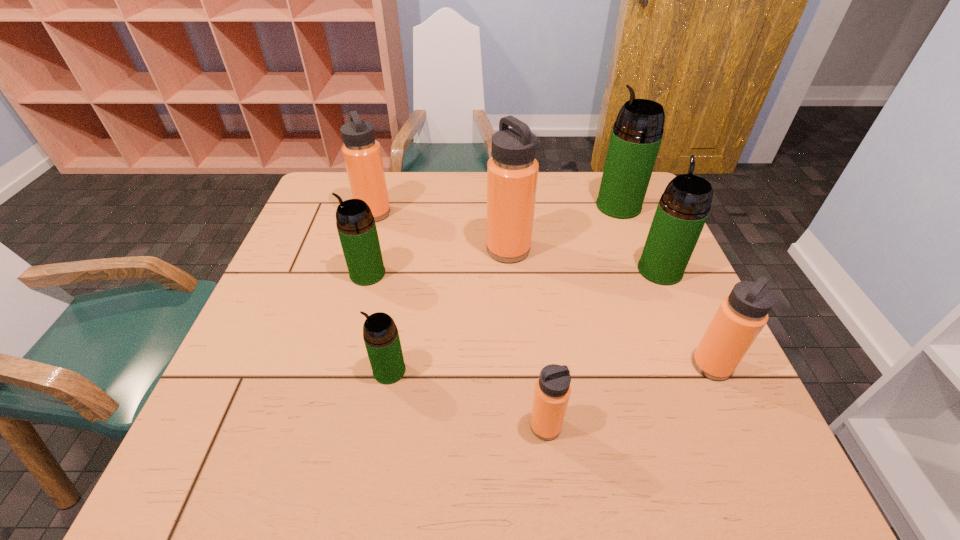
Find the location of `the nearest thermos bottle`. the nearest thermos bottle is located at coordinates (552, 391).

The height and width of the screenshot is (540, 960). I want to click on the smallest orange thermos bottle, so click(x=552, y=391).

Find the location of a particular element. The image size is (960, 540). vacant area situated from the spout of the farthest green thermos bottle is located at coordinates (496, 206).

Where is `vacant space located 0.390m from the spout of the farthest green thermos bottle`? vacant space located 0.390m from the spout of the farthest green thermos bottle is located at coordinates (467, 206).

Locate an element on the screen. Image resolution: width=960 pixels, height=540 pixels. free space located 0.090m from the spout of the farthest green thermos bottle is located at coordinates (566, 206).

The width and height of the screenshot is (960, 540). In order to click on free location located on the front of the biggest orange thermos bottle in this screenshot , I will do `click(514, 331)`.

This screenshot has width=960, height=540. In order to click on free space located 0.370m from the spout of the third smallest green thermos bottle in this screenshot , I will do `click(621, 180)`.

This screenshot has width=960, height=540. I want to click on vacant space situated from the spout of the third smallest green thermos bottle, so (627, 192).

At what (x,y) coordinates should I click in order to perform the action: click on vacant space situated from the spout of the third smallest green thermos bottle. Please return your answer as a coordinate pair (x, y). This screenshot has width=960, height=540. Looking at the image, I should click on (636, 213).

Find the location of a particular element. free space located 0.170m on the right of the farthest orange thermos bottle is located at coordinates (448, 213).